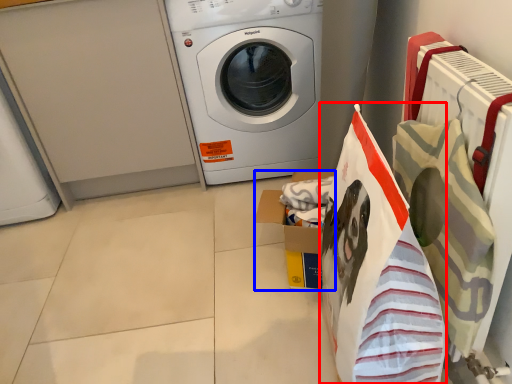
Question: Which point is further to the camera, shopping bag (highlighted by a red box) or cardboard box (highlighted by a blue box)?

Choices:
 (A) shopping bag
 (B) cardboard box

Answer: (B)